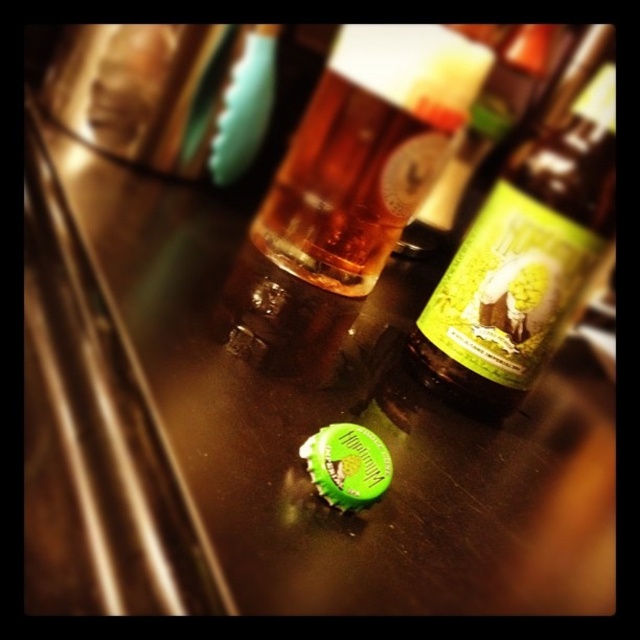
Question: Does green matte bottle at center have a lesser width compared to translucent amber glass at center?

Choices:
 (A) yes
 (B) no

Answer: (A)

Question: Does green matte bottle at center appear on the left side of translucent amber glass at center?

Choices:
 (A) yes
 (B) no

Answer: (B)

Question: Among these points, which one is nearest to the camera?

Choices:
 (A) (333, 44)
 (B) (461, 324)

Answer: (B)

Question: Where is green matte bottle at center located in relation to translucent amber glass at center in the image?

Choices:
 (A) left
 (B) right

Answer: (B)

Question: Which point appears farthest from the camera in this image?

Choices:
 (A) (572, 298)
 (B) (304, 177)

Answer: (B)